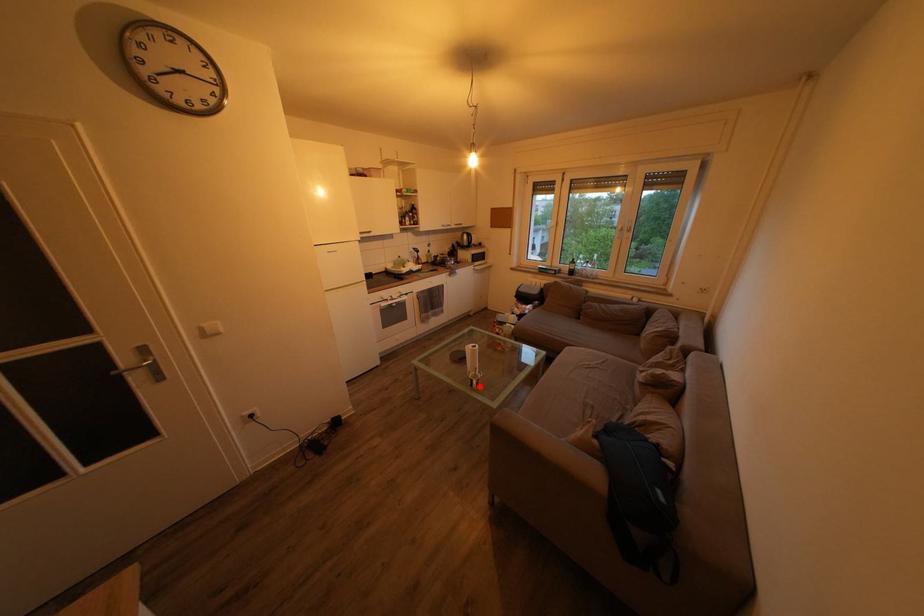
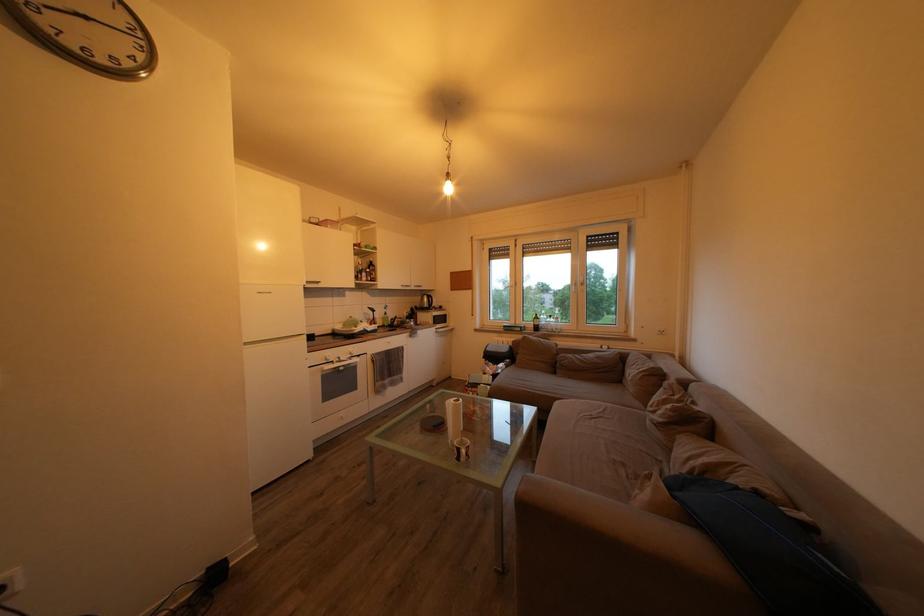
Find the pixel in the second image that matches the highlighted location in the first image.

(467, 456)